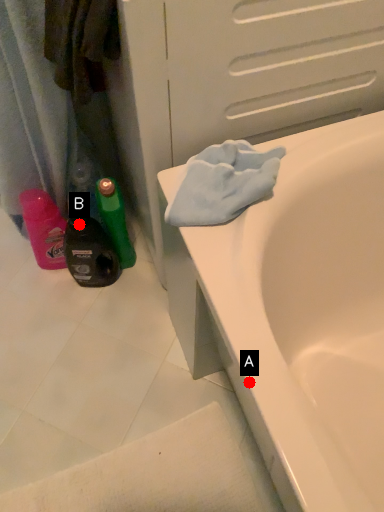
Question: Two points are circled on the image, labeled by A and B beside each circle. Which point appears closest to the camera in this image?

Choices:
 (A) A is closer
 (B) B is closer

Answer: (A)